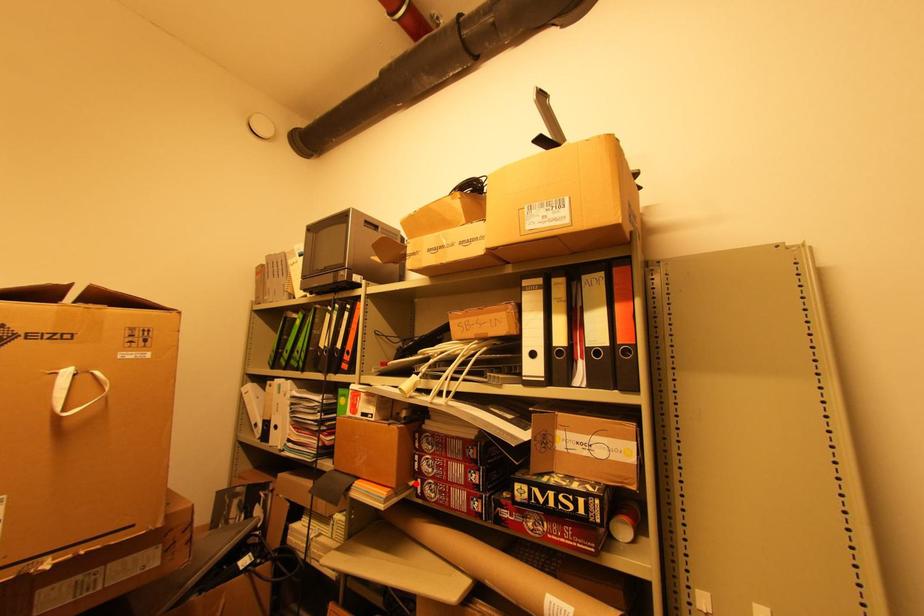
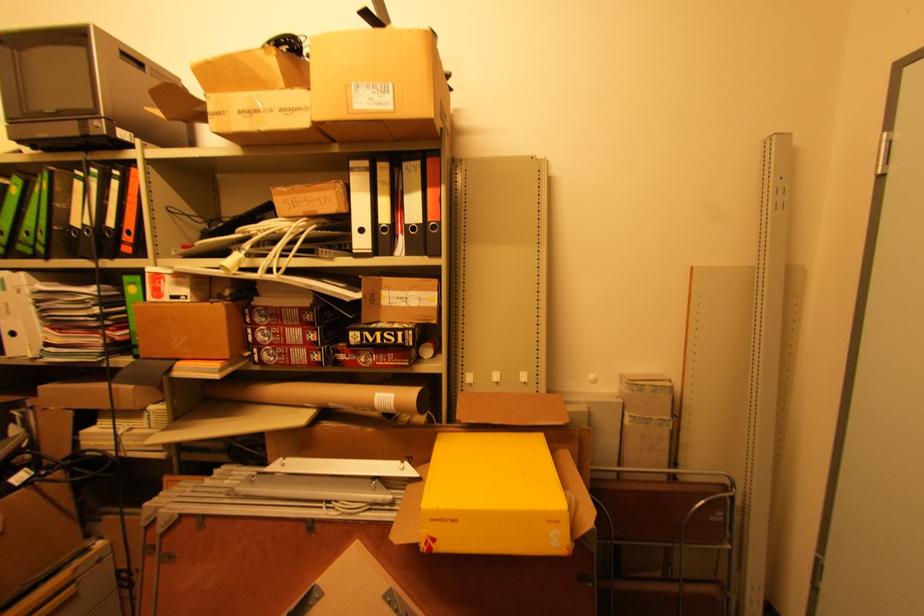
Question: I am providing you with two images of the same scene from different viewpoints. A red point is marked on the first image. Is the red point's position out of view in image 2?

Choices:
 (A) Yes
 (B) No

Answer: (B)